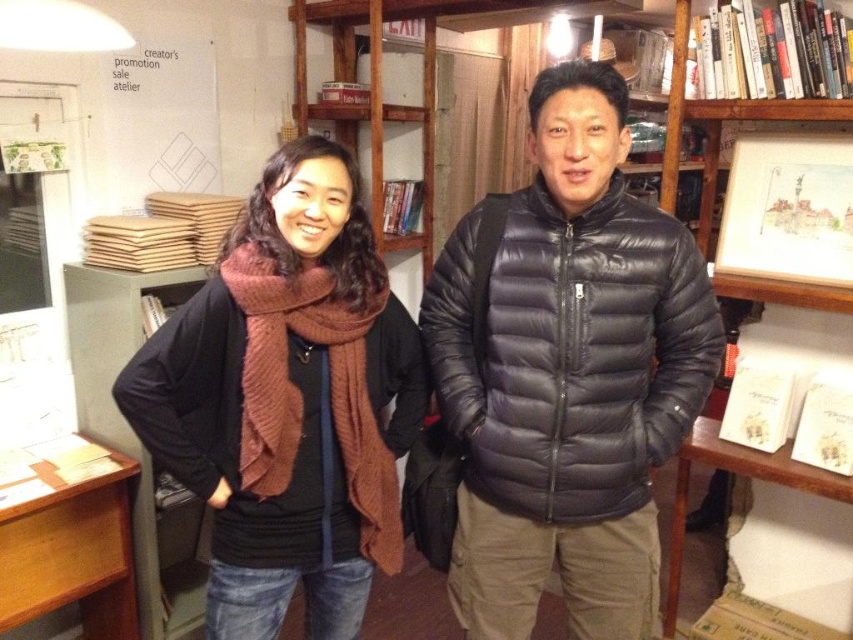
Question: Can you confirm if matte black jacket at center is positioned above green metal cabinet at left?

Choices:
 (A) no
 (B) yes

Answer: (B)

Question: Does brown knitted scarf at center appear on the right side of green metal cabinet at left?

Choices:
 (A) yes
 (B) no

Answer: (A)

Question: Is matte black jacket at center smaller than wooden picture frame at upper right?

Choices:
 (A) yes
 (B) no

Answer: (B)

Question: Estimate the real-world distances between objects in this image. Which object is closer to the matte black jacket at center?

Choices:
 (A) wooden picture frame at upper right
 (B) brown knitted scarf at center
 (C) green metal cabinet at left

Answer: (B)

Question: Which point appears closest to the camera in this image?

Choices:
 (A) (178, 541)
 (B) (747, 246)

Answer: (B)

Question: Which object is closer to the camera taking this photo?

Choices:
 (A) matte black jacket at center
 (B) green metal cabinet at left
 (C) brown knitted scarf at center

Answer: (A)